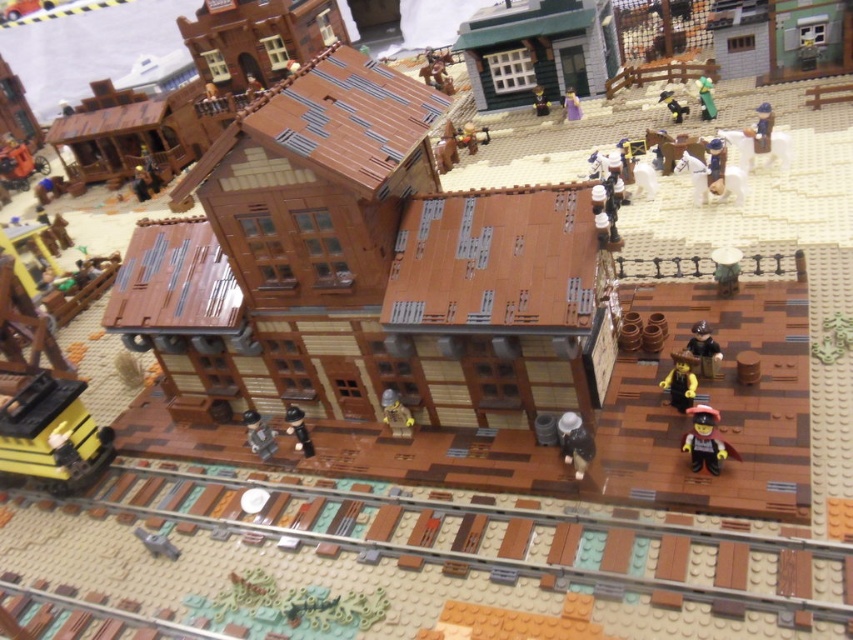
Who is more distant from viewer, (250, 422) or (679, 108)?

The point (679, 108) is behind.

Does point (262, 452) lie behind point (660, 97)?

No, it is not.

Identify the location of smooth gray figure at center. The height and width of the screenshot is (640, 853). (259, 435).

Can you confirm if matte black cowboy hat at lower center is bigger than brown matte minifigure at center?

Yes.

Does point (564, 458) come farther from viewer compared to point (389, 397)?

No, (564, 458) is closer to viewer.

Between point (582, 442) and point (404, 436), which one is positioned behind?

Positioned behind is point (404, 436).

Locate an element on the screen. The width and height of the screenshot is (853, 640). matte black cowboy hat at lower center is located at coordinates (575, 442).

Can you confirm if matte brown barrel at right is bigger than blue plastic figure at upper right?

Incorrect, matte brown barrel at right is not larger than blue plastic figure at upper right.

Between point (712, 260) and point (764, 145), which one is positioned in front?

Point (712, 260)

Locate an element on the screen. The width and height of the screenshot is (853, 640). matte brown barrel at right is located at coordinates (726, 269).